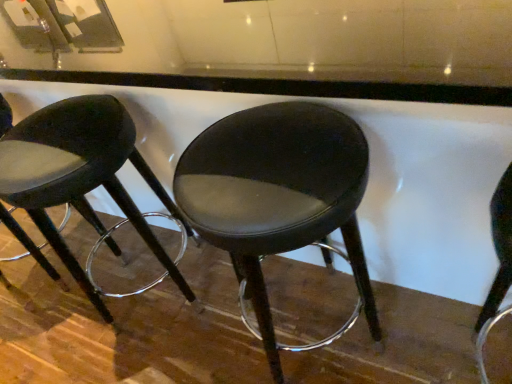
At what (x,y) coordinates should I click in order to perform the action: click on matte black stool at center, which is the 1th stool from left to right. Please return your answer as a coordinate pair (x, y). Looking at the image, I should click on (83, 179).

Image resolution: width=512 pixels, height=384 pixels. Describe the element at coordinates (83, 179) in the screenshot. I see `matte black stool at center, the second stool in the right-to-left sequence` at that location.

Image resolution: width=512 pixels, height=384 pixels. Describe the element at coordinates (277, 193) in the screenshot. I see `black leather stool at center, the 1th stool when ordered from right to left` at that location.

Locate an element on the screen. This screenshot has height=384, width=512. black leather stool at center, the 1th stool when ordered from right to left is located at coordinates (277, 193).

At what (x,y) coordinates should I click in order to perform the action: click on matte black stool at center, which is the 1th stool from left to right. Please return your answer as a coordinate pair (x, y). The image size is (512, 384). Looking at the image, I should click on (83, 179).

Is black leather stool at center, the 2th stool in the left-to-right sequence, to the right of matte black stool at center, the second stool in the right-to-left sequence, from the viewer's perspective?

Yes, black leather stool at center, the 2th stool in the left-to-right sequence, is to the right of matte black stool at center, the second stool in the right-to-left sequence.

Considering the relative positions of black leather stool at center, the 2th stool in the left-to-right sequence, and matte black stool at center, the second stool in the right-to-left sequence, in the image provided, is black leather stool at center, the 2th stool in the left-to-right sequence, behind matte black stool at center, the second stool in the right-to-left sequence,?

That is False.

Which point is more distant from viewer, (247, 165) or (117, 180)?

The point (117, 180) is farther from the camera.

In the scene shown: From the image's perspective, which is below, black leather stool at center, the 1th stool when ordered from right to left, or matte black stool at center, the second stool in the right-to-left sequence?

From the image's view, black leather stool at center, the 1th stool when ordered from right to left, is below.

From a real-world perspective, is black leather stool at center, the 1th stool when ordered from right to left, beneath matte black stool at center, the second stool in the right-to-left sequence?

Yes, from a real-world perspective, black leather stool at center, the 1th stool when ordered from right to left, is beneath matte black stool at center, the second stool in the right-to-left sequence.

Considering the sizes of objects black leather stool at center, the 1th stool when ordered from right to left, and matte black stool at center, which is the 1th stool from left to right, in the image provided, who is thinner, black leather stool at center, the 1th stool when ordered from right to left, or matte black stool at center, which is the 1th stool from left to right,?

black leather stool at center, the 1th stool when ordered from right to left, is thinner.

Considering the relative sizes of black leather stool at center, the 1th stool when ordered from right to left, and matte black stool at center, which is the 1th stool from left to right, in the image provided, is black leather stool at center, the 1th stool when ordered from right to left, taller than matte black stool at center, which is the 1th stool from left to right,?

Indeed, black leather stool at center, the 1th stool when ordered from right to left, has a greater height compared to matte black stool at center, which is the 1th stool from left to right.

Between black leather stool at center, the 1th stool when ordered from right to left, and matte black stool at center, which is the 1th stool from left to right, which one has smaller size?

With smaller size is black leather stool at center, the 1th stool when ordered from right to left.

Is matte black stool at center, which is the 1th stool from left to right, inside black leather stool at center, the 2th stool in the left-to-right sequence?

No.

From the picture: Can you see black leather stool at center, the 2th stool in the left-to-right sequence, touching matte black stool at center, the second stool in the right-to-left sequence?

black leather stool at center, the 2th stool in the left-to-right sequence, and matte black stool at center, the second stool in the right-to-left sequence, are clearly separated.

Looking at this image, is matte black stool at center, the second stool in the right-to-left sequence, at the back of black leather stool at center, the 1th stool when ordered from right to left?

No, black leather stool at center, the 1th stool when ordered from right to left,'s orientation is not away from matte black stool at center, the second stool in the right-to-left sequence.

Locate an element on the screen. This screenshot has height=384, width=512. stool to the right of matte black stool at center, the second stool in the right-to-left sequence is located at coordinates (277, 193).

Which object is positioned more to the right, matte black stool at center, which is the 1th stool from left to right, or black leather stool at center, the 1th stool when ordered from right to left?

black leather stool at center, the 1th stool when ordered from right to left, is more to the right.

Is matte black stool at center, the second stool in the right-to-left sequence, closer to camera compared to black leather stool at center, the 2th stool in the left-to-right sequence?

That is False.

Considering the points (133, 151) and (232, 254), which point is behind, point (133, 151) or point (232, 254)?

The point (133, 151) is behind.

From the image's perspective, is matte black stool at center, which is the 1th stool from left to right, beneath black leather stool at center, the 1th stool when ordered from right to left?

Actually, matte black stool at center, which is the 1th stool from left to right, appears above black leather stool at center, the 1th stool when ordered from right to left, in the image.

From a real-world perspective, who is located higher, matte black stool at center, the second stool in the right-to-left sequence, or black leather stool at center, the 2th stool in the left-to-right sequence?

From a 3D spatial view, matte black stool at center, the second stool in the right-to-left sequence, is above.

Does matte black stool at center, which is the 1th stool from left to right, have a lesser width compared to black leather stool at center, the 1th stool when ordered from right to left?

Incorrect, the width of matte black stool at center, which is the 1th stool from left to right, is not less than that of black leather stool at center, the 1th stool when ordered from right to left.

Can you confirm if matte black stool at center, the second stool in the right-to-left sequence, is shorter than black leather stool at center, the 2th stool in the left-to-right sequence?

Correct, matte black stool at center, the second stool in the right-to-left sequence, is not as tall as black leather stool at center, the 2th stool in the left-to-right sequence.

Who is smaller, matte black stool at center, the second stool in the right-to-left sequence, or black leather stool at center, the 1th stool when ordered from right to left?

Smaller between the two is black leather stool at center, the 1th stool when ordered from right to left.

Is matte black stool at center, which is the 1th stool from left to right, outside of black leather stool at center, the 1th stool when ordered from right to left?

Indeed, matte black stool at center, which is the 1th stool from left to right, is completely outside black leather stool at center, the 1th stool when ordered from right to left.

Is there a large distance between matte black stool at center, the second stool in the right-to-left sequence, and black leather stool at center, the 1th stool when ordered from right to left?

matte black stool at center, the second stool in the right-to-left sequence, is near black leather stool at center, the 1th stool when ordered from right to left, not far away.

Is matte black stool at center, the second stool in the right-to-left sequence, facing away from black leather stool at center, the 2th stool in the left-to-right sequence?

matte black stool at center, the second stool in the right-to-left sequence, is not turned away from black leather stool at center, the 2th stool in the left-to-right sequence.

How different are the orientations of matte black stool at center, the second stool in the right-to-left sequence, and black leather stool at center, the 1th stool when ordered from right to left, in degrees?

6.84e-05 degrees separate the facing orientations of matte black stool at center, the second stool in the right-to-left sequence, and black leather stool at center, the 1th stool when ordered from right to left.

Could you measure the distance between matte black stool at center, which is the 1th stool from left to right, and black leather stool at center, the 1th stool when ordered from right to left?

The distance of matte black stool at center, which is the 1th stool from left to right, from black leather stool at center, the 1th stool when ordered from right to left, is 18.57 inches.

In the image, there is a black leather stool at center, the 1th stool when ordered from right to left. At what (x,y) coordinates should I click in order to perform the action: click on stool above it (from the image's perspective). Please return your answer as a coordinate pair (x, y). Looking at the image, I should click on (83, 179).

The image size is (512, 384). I want to click on stool above the black leather stool at center, the 2th stool in the left-to-right sequence (from a real-world perspective), so click(83, 179).

What are the coordinates of `stool located in front of the matte black stool at center, the second stool in the right-to-left sequence` in the screenshot? It's located at (277, 193).